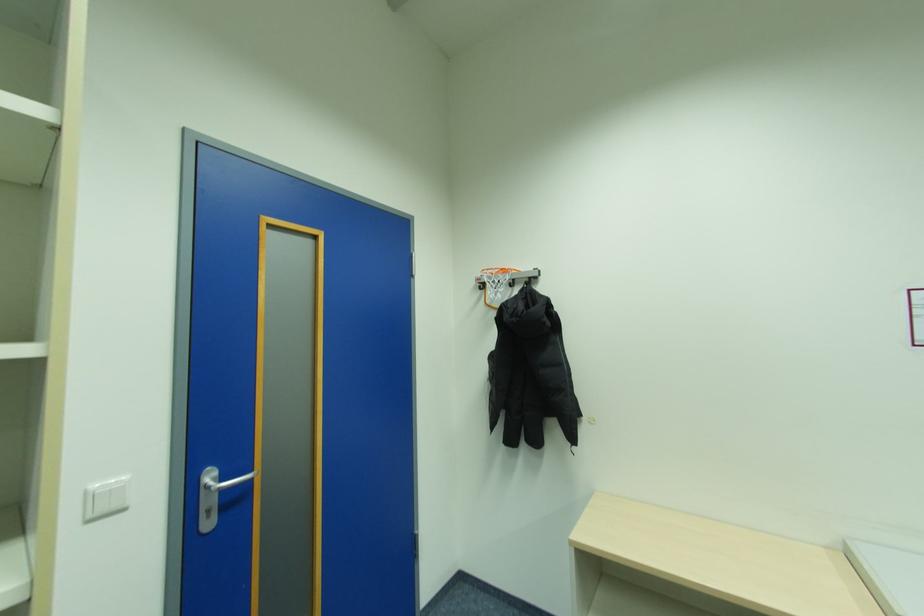
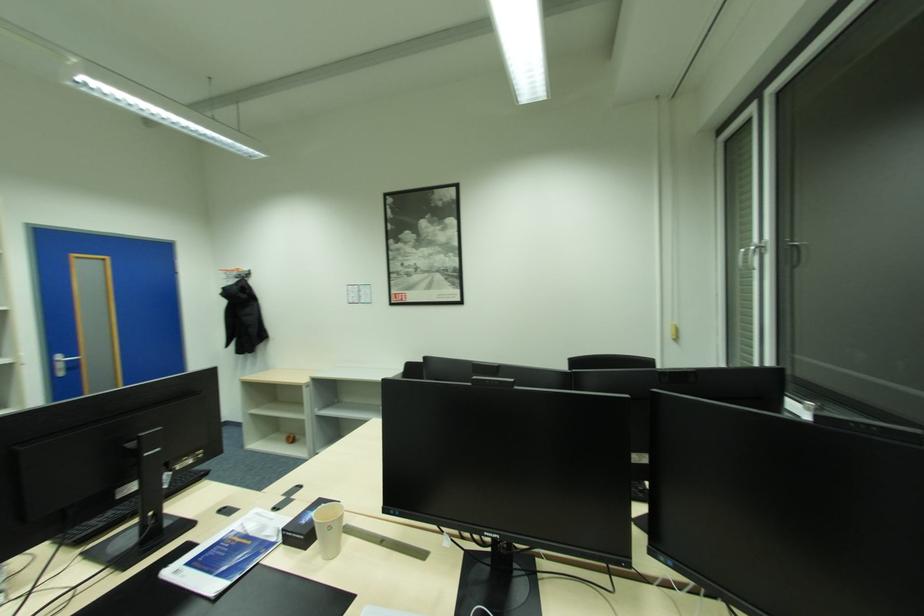
In a continuous first-person perspective shot, in which direction is the camera moving?

The cameraman moved toward right, backward.